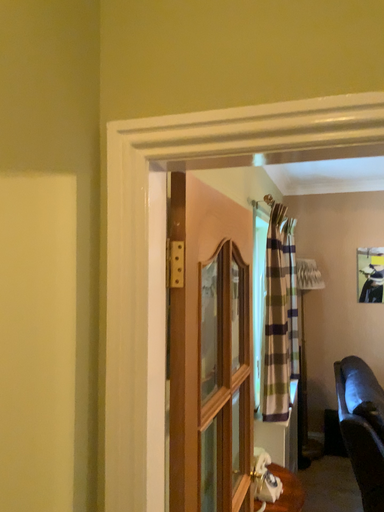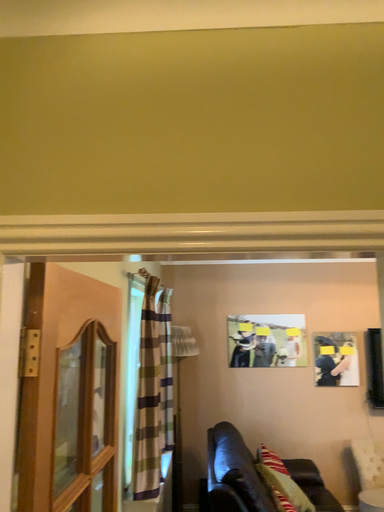
Question: Which way did the camera rotate in the video?

Choices:
 (A) rotated left
 (B) rotated right

Answer: (B)